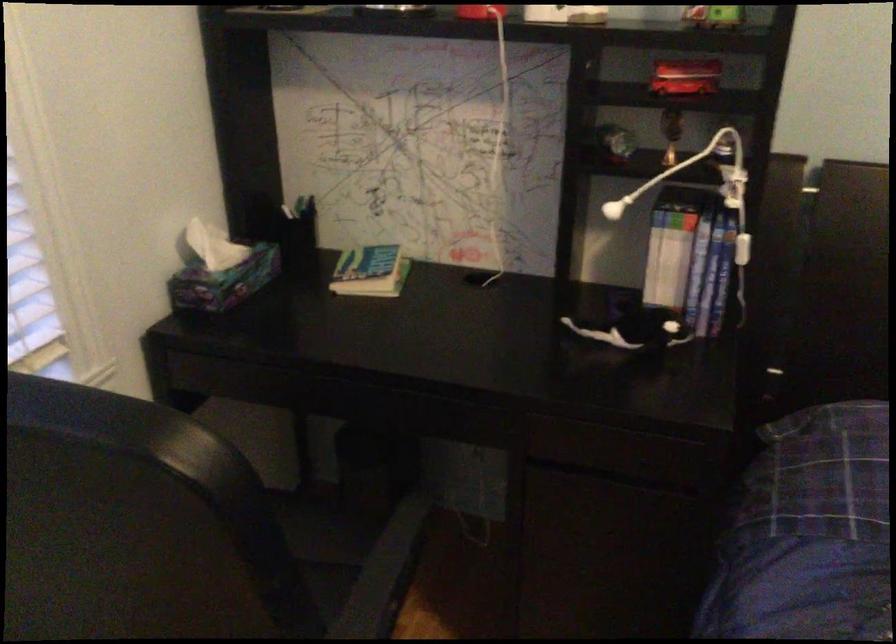
Find where to press the white cord switch. Please return your answer as a coordinate pair (x, y).

(742, 249)